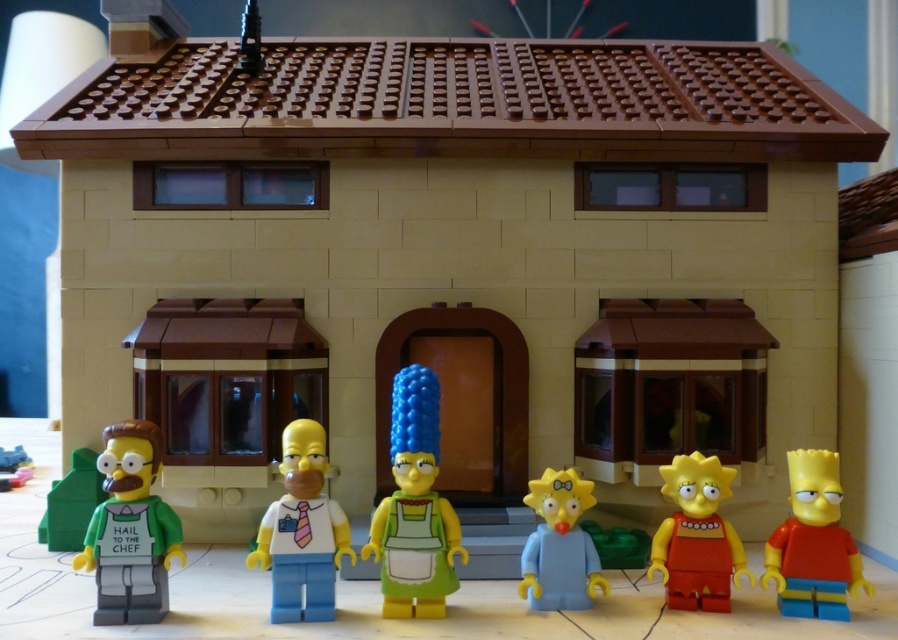
Does white matte shirt and tie at center have a greater height compared to light blue plastic maggie simpson at center?

Yes, white matte shirt and tie at center is taller than light blue plastic maggie simpson at center.

This screenshot has height=640, width=898. I want to click on white matte shirt and tie at center, so click(x=302, y=531).

Locate an element on the screen. Image resolution: width=898 pixels, height=640 pixels. white matte shirt and tie at center is located at coordinates (302, 531).

Does matte red dress at lower right come behind light blue plastic maggie simpson at center?

No, matte red dress at lower right is closer to the viewer.

Based on the photo, is matte red dress at lower right closer to the viewer compared to light blue plastic maggie simpson at center?

Yes, it is in front of light blue plastic maggie simpson at center.

Is point (707, 513) less distant than point (544, 568)?

Yes, point (707, 513) is in front of point (544, 568).

The image size is (898, 640). I want to click on matte red dress at lower right, so click(x=697, y=536).

Which of these two, matte red dress at lower right or smooth plastic toy at lower left, stands shorter?

Standing shorter between the two is smooth plastic toy at lower left.

Which is above, matte red dress at lower right or smooth plastic toy at lower left?

matte red dress at lower right is above.

Which is in front, point (720, 588) or point (6, 476)?

Point (720, 588) is more forward.

Where is `matte red dress at lower right`? The width and height of the screenshot is (898, 640). matte red dress at lower right is located at coordinates (697, 536).